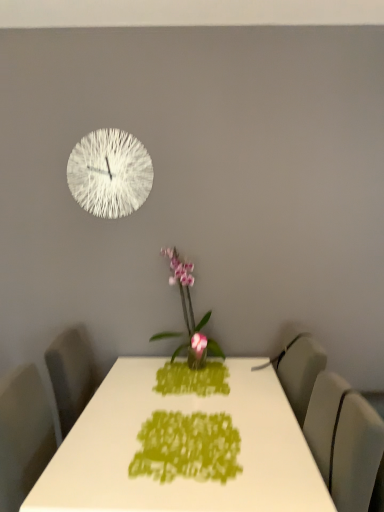
Question: Is green fabric placemat at center in front of white glossy table at center?

Choices:
 (A) yes
 (B) no

Answer: (B)

Question: Is green fabric placemat at center not inside white glossy table at center?

Choices:
 (A) no
 (B) yes

Answer: (A)

Question: Could you tell me if green fabric placemat at center is turned towards white glossy table at center?

Choices:
 (A) no
 (B) yes

Answer: (B)

Question: From a real-world perspective, is green fabric placemat at center on white glossy table at center?

Choices:
 (A) yes
 (B) no

Answer: (A)

Question: Is green fabric placemat at center thinner than white glossy table at center?

Choices:
 (A) yes
 (B) no

Answer: (A)

Question: Considering the relative sizes of green fabric placemat at center and white glossy table at center in the image provided, is green fabric placemat at center taller than white glossy table at center?

Choices:
 (A) yes
 (B) no

Answer: (B)

Question: Considering the relative sizes of white textured clock at upper left and pink glossy orchid at center in the image provided, is white textured clock at upper left bigger than pink glossy orchid at center?

Choices:
 (A) yes
 (B) no

Answer: (B)

Question: Is white textured clock at upper left thinner than pink glossy orchid at center?

Choices:
 (A) yes
 (B) no

Answer: (A)

Question: Considering the relative sizes of white textured clock at upper left and pink glossy orchid at center in the image provided, is white textured clock at upper left wider than pink glossy orchid at center?

Choices:
 (A) no
 (B) yes

Answer: (A)

Question: Is white textured clock at upper left placed right next to pink glossy orchid at center?

Choices:
 (A) yes
 (B) no

Answer: (B)

Question: From a real-world perspective, is white textured clock at upper left positioned over pink glossy orchid at center based on gravity?

Choices:
 (A) yes
 (B) no

Answer: (A)

Question: Does white textured clock at upper left turn towards pink glossy orchid at center?

Choices:
 (A) yes
 (B) no

Answer: (B)

Question: Is pink glossy orchid at center closer to camera compared to matte gray swivel chair at right?

Choices:
 (A) no
 (B) yes

Answer: (A)